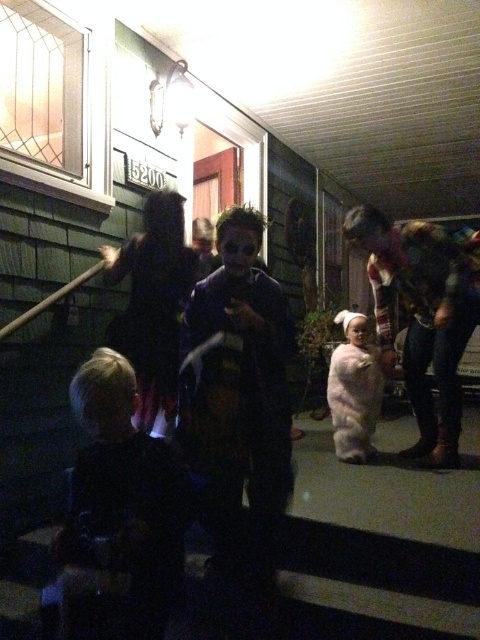
Question: Which point is closer to the camera?

Choices:
 (A) fuzzy white bear at center
 (B) dark blue shirt at lower left
 (C) black velvet dress at center

Answer: (B)

Question: Which point is farther to the camera?

Choices:
 (A) (156, 605)
 (B) (363, 355)
 (C) (154, 250)
 (D) (199, 298)

Answer: (B)

Question: Can you confirm if matte black costume at center is smaller than fuzzy white bear at center?

Choices:
 (A) no
 (B) yes

Answer: (A)

Question: Is flannel shirt at right above fuzzy white bear at center?

Choices:
 (A) yes
 (B) no

Answer: (A)

Question: Which point is farther from the camera taking this photo?

Choices:
 (A) (180, 307)
 (B) (430, 416)
 (C) (86, 545)
 (D) (238, 234)

Answer: (B)

Question: Does matte black costume at center have a lesser width compared to dark blue shirt at lower left?

Choices:
 (A) yes
 (B) no

Answer: (B)